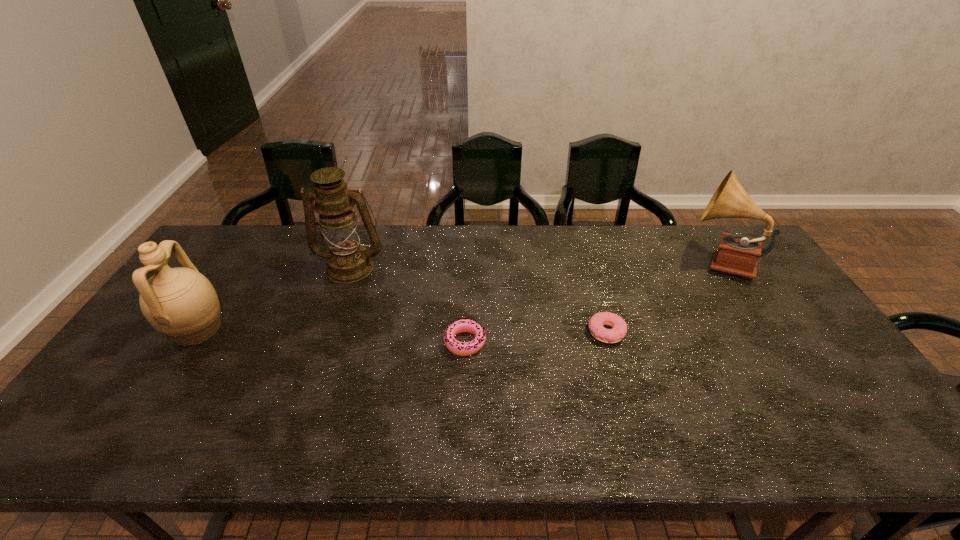
Find the location of `vacant space that's between the second object from left to right and the right doughnut`. vacant space that's between the second object from left to right and the right doughnut is located at coordinates (478, 300).

Identify which object is the fourth nearest to the right doughnut. Please provide its 2D coordinates. Your answer should be formatted as a tuple, i.e. [(x, y)], where the tuple contains the x and y coordinates of a point satisfying the conditions above.

[(180, 303)]

Select which object is the closest to the left doughnut. Please provide its 2D coordinates. Your answer should be formatted as a tuple, i.e. [(x, y)], where the tuple contains the x and y coordinates of a point satisfying the conditions above.

[(348, 261)]

Find the location of a particular element. free space that satisfies the following two spatial constraints: 1. on the front side of the left doughnut; 2. on the right side of the pitcher is located at coordinates (189, 342).

Image resolution: width=960 pixels, height=540 pixels. I want to click on free space that satisfies the following two spatial constraints: 1. on the horn of the rightmost object; 2. on the front side of the oil lamp, so click(x=723, y=267).